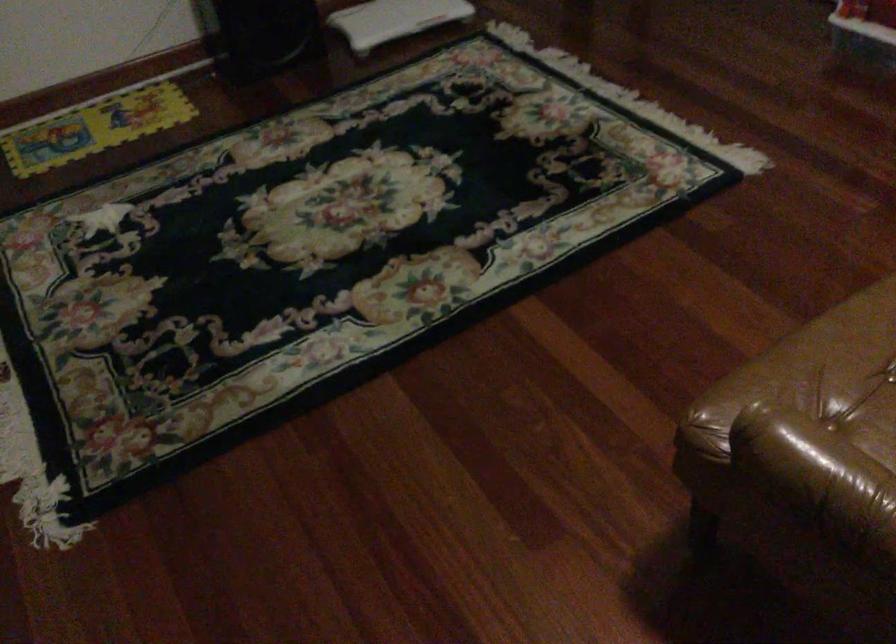
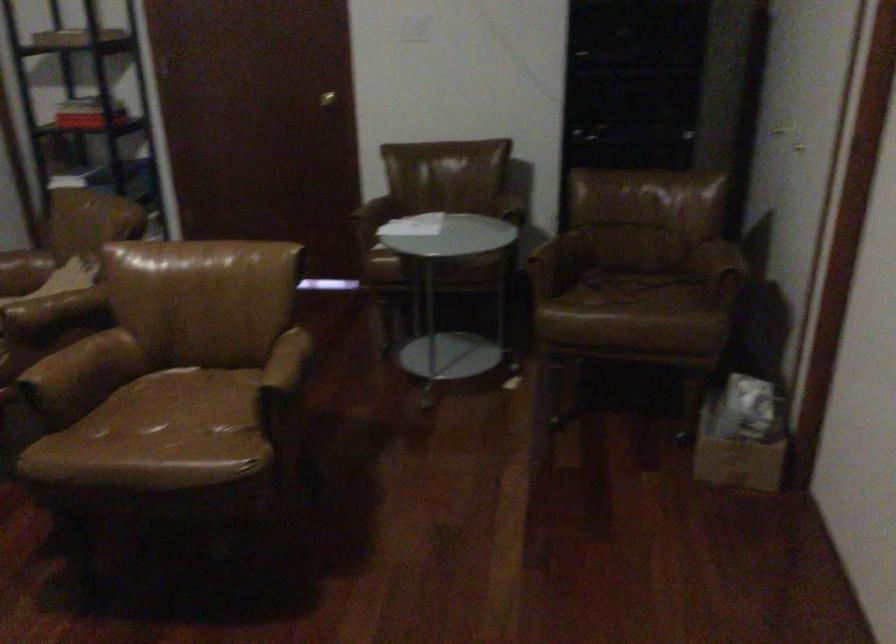
Where in the second image is the point corresponding to (807,457) from the first image?

(283, 371)